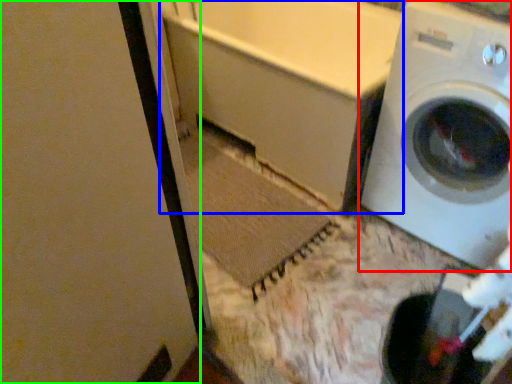
Question: Considering the real-world distances, which object is closest to washing machine (highlighted by a red box)? bath (highlighted by a blue box) or screen door (highlighted by a green box).

Choices:
 (A) bath
 (B) screen door

Answer: (A)